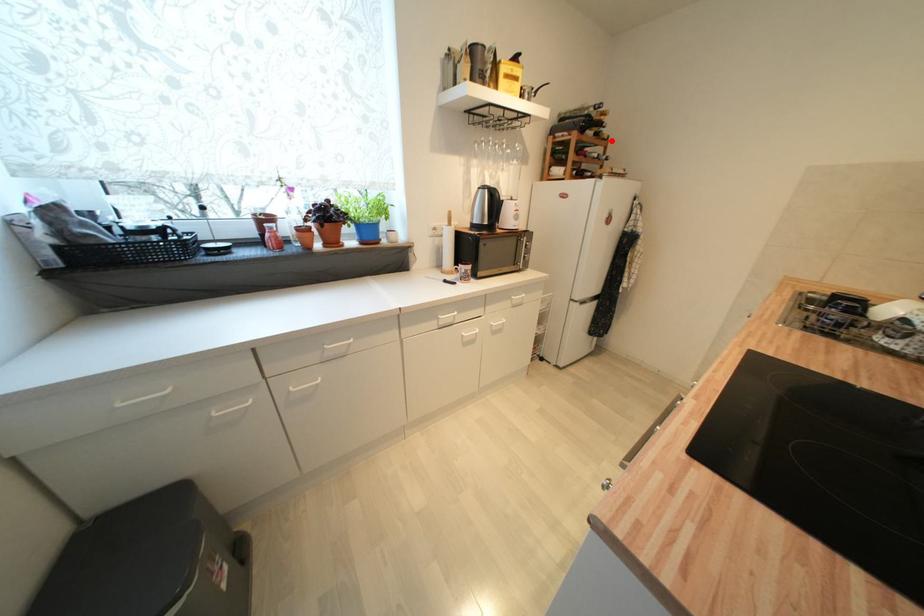
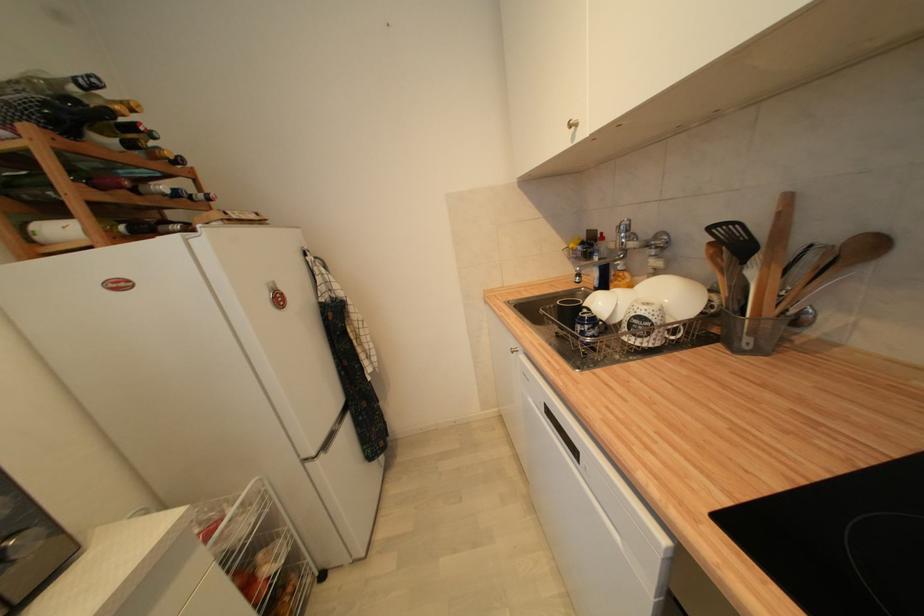
Locate, in the second image, the point that corresponds to the highlighted location in the first image.

(186, 164)